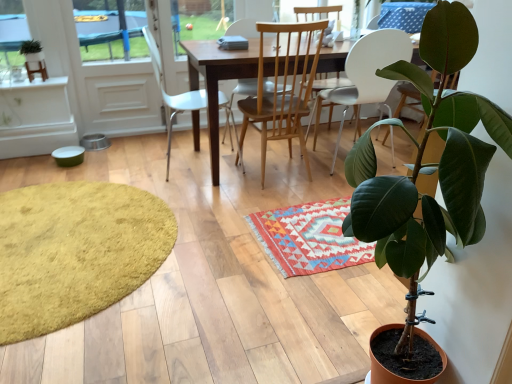
Question: Visually, is wooden table at center positioned to the left or to the right of green matte plant at upper left, which is counted as the 1th houseplant, starting from the left?

Choices:
 (A) left
 (B) right

Answer: (B)

Question: Considering their positions, is wooden table at center located in front of or behind green matte plant at upper left, which ranks as the 2th houseplant in right-to-left order?

Choices:
 (A) behind
 (B) front

Answer: (B)

Question: Which object is positioned closest to the white plastic chair at center, placed as the first chair when sorted from left to right?

Choices:
 (A) wooden table at center
 (B) yellow shaggy rug at lower left, which appears as the second mat when viewed from the right
 (C) green matte plant at lower right, which is counted as the 1th houseplant, starting from the right
 (D) green matte plant at upper left, which ranks as the 2th houseplant in right-to-left order
 (E) white plastic chair at center, which is the first chair in right-to-left order

Answer: (A)

Question: Considering the real-world distances, which object is farthest from the light wood/wooden chair at center, which is counted as the 2th chair, starting from the right?

Choices:
 (A) white plastic chair at center, positioned as the 3th chair in left-to-right order
 (B) yellow shaggy rug at lower left, which appears as the second mat when viewed from the right
 (C) white glossy screen door at upper left
 (D) white plastic chair at center, acting as the 3th chair starting from the right
 (E) multicolored woven rug at center, marked as the 2th mat in a left-to-right arrangement

Answer: (B)